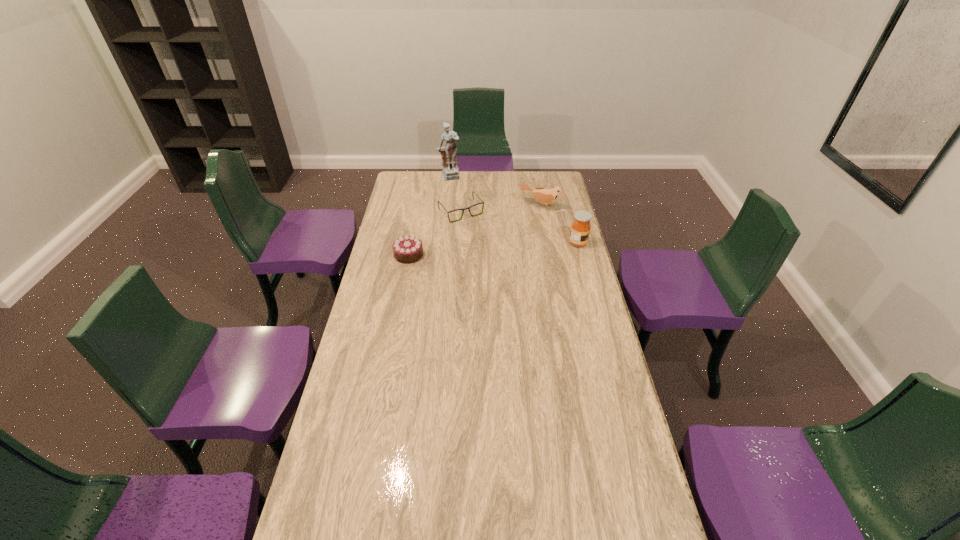
Find the location of a particular element. vacant area that lies between the chocolate cake and the bird is located at coordinates (474, 231).

Where is `vacant area that lies between the honey and the bird`? The width and height of the screenshot is (960, 540). vacant area that lies between the honey and the bird is located at coordinates (560, 225).

Find the location of a particular element. The width and height of the screenshot is (960, 540). free point between the tallest object and the fourth tallest object is located at coordinates (429, 216).

I want to click on free space between the figurine and the second tallest object, so click(514, 210).

Locate an element on the screen. free space between the honey and the shortest object is located at coordinates (519, 228).

At what (x,y) coordinates should I click in order to perform the action: click on empty space that is in between the farthest object and the leftmost object. Please return your answer as a coordinate pair (x, y). This screenshot has width=960, height=540. Looking at the image, I should click on (429, 216).

You are a GUI agent. You are given a task and a screenshot of the screen. Output one action in this format:
    pyautogui.click(x=<x>, y=<y>)
    Task: Click on the object that stands as the fourth closest to the tallest object
    This screenshot has width=960, height=540.
    Given the screenshot: What is the action you would take?
    coord(580,229)

Where is `object that stands as the closest to the leftmost object`? This screenshot has width=960, height=540. object that stands as the closest to the leftmost object is located at coordinates (482, 202).

Identify the location of free space that satisfies the following two spatial constraints: 1. on the back side of the second tallest object; 2. on the front-facing side of the leftmost object. (411, 243).